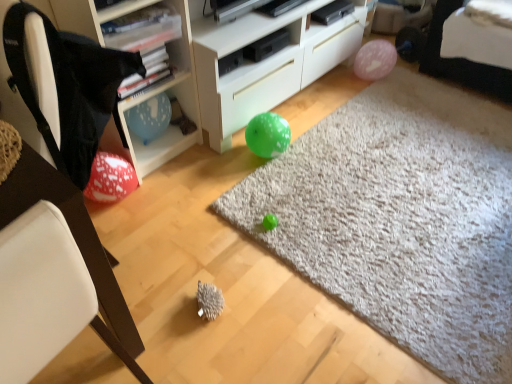
This screenshot has width=512, height=384. In order to click on green matte balloon at center in this screenshot , I will do `click(401, 219)`.

What is the approximate width of white matte cabinet at center?

white matte cabinet at center is 17.46 inches in width.

Where is `blue paper balloon at upper left`? The height and width of the screenshot is (384, 512). blue paper balloon at upper left is located at coordinates (167, 127).

From a real-world perspective, is pink matte balloon at upper right above or below green matte balloon at center?

pink matte balloon at upper right is situated higher than green matte balloon at center in the real world.

Where is `plain located below the pink matte balloon at upper right (from the image's perspective)`? The width and height of the screenshot is (512, 384). plain located below the pink matte balloon at upper right (from the image's perspective) is located at coordinates (401, 219).

Is pink matte balloon at upper right taller than green matte balloon at center?

Indeed, pink matte balloon at upper right has a greater height compared to green matte balloon at center.

Considering the positions of objects pink matte balloon at upper right and black fabric bean bag chair at left in the image provided, who is in front, pink matte balloon at upper right or black fabric bean bag chair at left?

Positioned in front is black fabric bean bag chair at left.

Is pink matte balloon at upper right next to black fabric bean bag chair at left and touching it?

They are not placed beside each other.

The height and width of the screenshot is (384, 512). I want to click on bean bag chair in front of the pink matte balloon at upper right, so click(x=62, y=88).

Between pink matte balloon at upper right and black fabric bean bag chair at left, which one has less height?

Standing shorter between the two is pink matte balloon at upper right.

Who is smaller, green matte balloon at center or white matte cabinet at center?

With smaller size is green matte balloon at center.

Considering the relative positions of green matte balloon at center and white matte cabinet at center in the image provided, is green matte balloon at center to the left or to the right of white matte cabinet at center?

In the image, green matte balloon at center appears on the right side of white matte cabinet at center.

Which is farther, (465,263) or (336,52)?

The point (336,52) is more distant.

Is pink matte balloon at upper right located within green matte balloon at center?

Definitely not — pink matte balloon at upper right is not inside green matte balloon at center.

Relative to pink matte balloon at upper right, is green matte balloon at center in front or behind?

In the image, green matte balloon at center appears in front of pink matte balloon at upper right.

In the scene shown: Could you tell me if green matte balloon at center is turned towards pink matte balloon at upper right?

No, green matte balloon at center is not aimed at pink matte balloon at upper right.

Is green matte balloon at center wider or thinner than pink matte balloon at upper right?

Clearly, green matte balloon at center has more width compared to pink matte balloon at upper right.

Is black fabric bean bag chair at left a part of green matte balloon at center?

No, black fabric bean bag chair at left is not surrounded by green matte balloon at center.

Is green matte balloon at center facing away from black fabric bean bag chair at left?

green matte balloon at center does not have its back to black fabric bean bag chair at left.

Is point (434, 239) farther from viewer compared to point (34, 112)?

Yes, point (434, 239) is farther from viewer.

Between green matte balloon at center and black fabric bean bag chair at left, which one appears on the left side from the viewer's perspective?

Positioned to the left is black fabric bean bag chair at left.

Considering the points (140, 161) and (374, 61), which point is behind, point (140, 161) or point (374, 61)?

The point (374, 61) is farther from the camera.

Which object is closer to the camera, blue paper balloon at upper left or pink matte balloon at upper right?

Positioned in front is blue paper balloon at upper left.

This screenshot has width=512, height=384. Identify the location of cabinet above the pink matte balloon at upper right (from a real-world perspective). (167, 127).

Is blue paper balloon at upper left located outside pink matte balloon at upper right?

Yes, blue paper balloon at upper left is not within pink matte balloon at upper right.

How distant is white plastic shelf at upper left from white matte cabinet at center?

The distance of white plastic shelf at upper left from white matte cabinet at center is 15.10 inches.

Considering the positions of point (147, 151) and point (333, 44), is point (147, 151) closer or farther from the camera than point (333, 44)?

Point (147, 151) is closer to the camera than point (333, 44).

Looking at this image, does white plastic shelf at upper left have a lesser height compared to white matte cabinet at center?

No, white plastic shelf at upper left is not shorter than white matte cabinet at center.

Identify the location of shelf in front of the white matte cabinet at center. Image resolution: width=512 pixels, height=384 pixels. (148, 89).

Where is `plain beneath the pink matte balloon at upper right (from a real-world perspective)`? This screenshot has width=512, height=384. plain beneath the pink matte balloon at upper right (from a real-world perspective) is located at coordinates (401, 219).

Where is `balloon behind the black fabric bean bag chair at left`? balloon behind the black fabric bean bag chair at left is located at coordinates [375, 60].

When comparing their distances from white plastic chair at left, does white matte cabinet at center or white plastic shelf at upper left seem further?

Among the two, white matte cabinet at center is located further to white plastic chair at left.

When comparing their distances from pink matte balloon at upper right, does green matte balloon at center or black fabric bean bag chair at left seem closer?

green matte balloon at center.

Considering their positions, is green matte balloon at center positioned closer to black fabric bean bag chair at left than white matte cabinet at center?

white matte cabinet at center is closer to black fabric bean bag chair at left.

From the image, which object appears to be nearer to pink matte balloon at upper right, blue paper balloon at upper left or black fabric bean bag chair at left?

Based on the image, blue paper balloon at upper left appears to be nearer to pink matte balloon at upper right.

In the scene shown: From the image, which object appears to be nearer to green matte balloon at center, white matte cabinet at center or black fabric bean bag chair at left?

white matte cabinet at center.

Looking at the image, which one is located closer to blue paper balloon at upper left, black fabric bean bag chair at left or white matte cabinet at center?

Among the two, white matte cabinet at center is located nearer to blue paper balloon at upper left.

Based on their spatial positions, is black fabric bean bag chair at left or blue paper balloon at upper left further from pink matte balloon at upper right?

black fabric bean bag chair at left is positioned further to the anchor pink matte balloon at upper right.

Looking at the image, which one is located closer to green matte balloon at center, pink matte balloon at upper right or blue paper balloon at upper left?

blue paper balloon at upper left lies closer to green matte balloon at center than the other object.

Where is `shelf between black fabric bean bag chair at left and pink matte balloon at upper right along the z-axis`? The height and width of the screenshot is (384, 512). shelf between black fabric bean bag chair at left and pink matte balloon at upper right along the z-axis is located at coordinates coord(148,89).

Find the location of a particular element. The width and height of the screenshot is (512, 384). cabinetry between black fabric bean bag chair at left and pink matte balloon at upper right in the front-back direction is located at coordinates (266, 63).

The image size is (512, 384). I want to click on cabinetry situated between white plastic shelf at upper left and pink matte balloon at upper right from left to right, so click(266, 63).

At what (x,y) coordinates should I click in order to perform the action: click on bean bag chair located between white plastic chair at left and green matte balloon at center in the left-right direction. Please return your answer as a coordinate pair (x, y). Looking at the image, I should click on (62, 88).